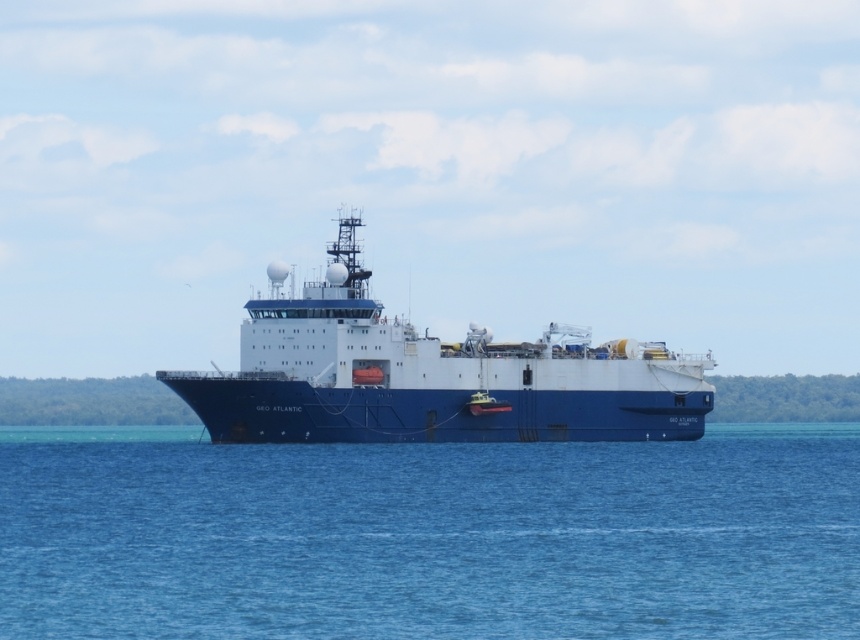
From the picture: You are standing on the deck of the GEO ATLANTIC ship and see two points marked on the deck. The first point is at coordinates point(759, 513) and the second point is at point(564, 419). If you are facing the front of the ship, which point is closer to the bow?

Point(759, 513) is in front of point(564, 419), so it is closer to the bow of the GEO ATLANTIC ship.